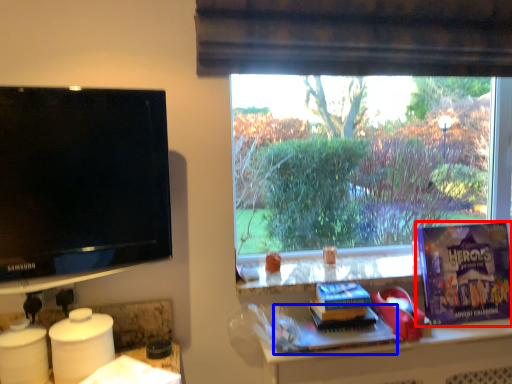
Question: Which of the following is the farthest to the observer, paperback book (highlighted by a red box) or book (highlighted by a blue box)?

Choices:
 (A) paperback book
 (B) book

Answer: (A)